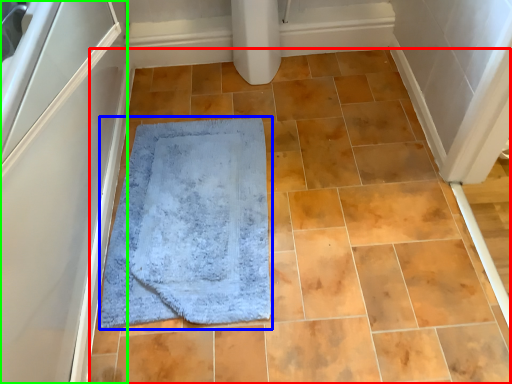
Question: Based on their relative distances, which object is farther from ceramic tile (highlighted by a red box)? Choose from bath mat (highlighted by a blue box) and screen door (highlighted by a green box).

Choices:
 (A) bath mat
 (B) screen door

Answer: (B)